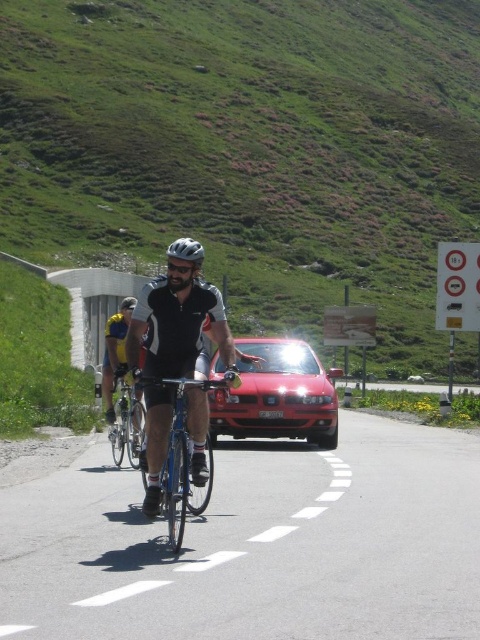
You are a cyclist planning to ride along the road shown in the image. You notice the green grassy hillside at upper center and the matte black helmet at center. Which object would block your view more if you were looking ahead while riding?

The green grassy hillside at upper center would block your view more than the matte black helmet at center because it is much taller.

You are a cyclist looking at the scene and want to know if the green grassy hillside at upper center is positioned higher than the matte black helmet at center. Can you tell me based on the image?

Yes, the green grassy hillside at upper center is above matte black helmet at center according to the description.

You are a cyclist trying to avoid the red car ahead. You see the green grassy hillside at upper center and the silver metallic bicycle at center. Which direction should you turn to move away from the road?

You should turn towards the green grassy hillside at upper center because it is positioned on the right side of the silver metallic bicycle at center, indicating that moving in that direction would take you away from the road and towards the hillside.